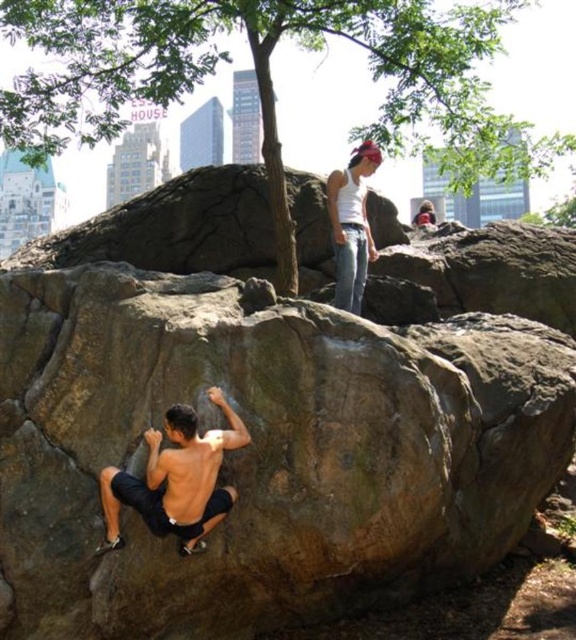
Question: From the image, what is the correct spatial relationship of green leafy tree at upper center in relation to shiny black shorts at lower left?

Choices:
 (A) right
 (B) left

Answer: (A)

Question: Can you confirm if green leafy tree at upper center is positioned to the right of shiny black shorts at lower left?

Choices:
 (A) yes
 (B) no

Answer: (A)

Question: Does green leafy tree at upper center have a smaller size compared to shiny black shorts at lower left?

Choices:
 (A) no
 (B) yes

Answer: (A)